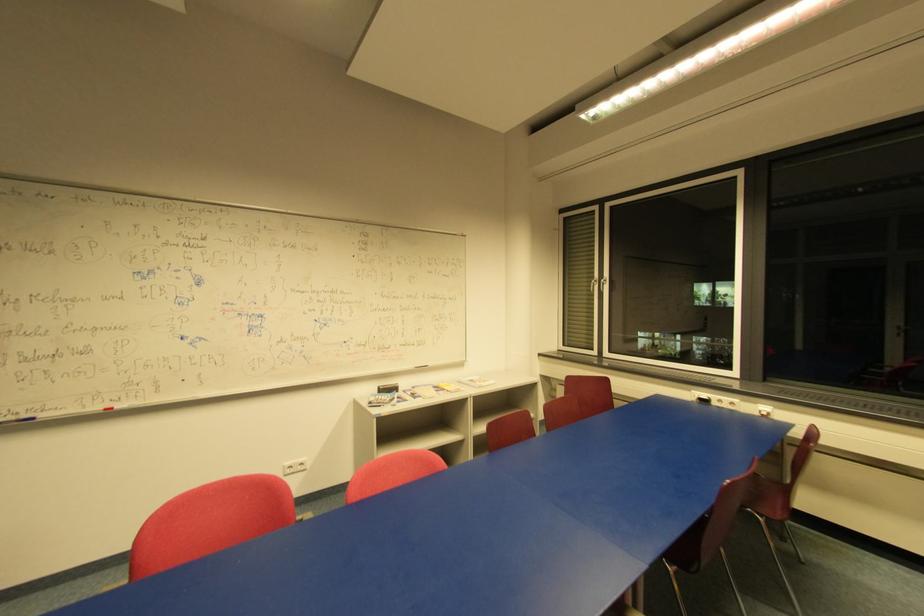
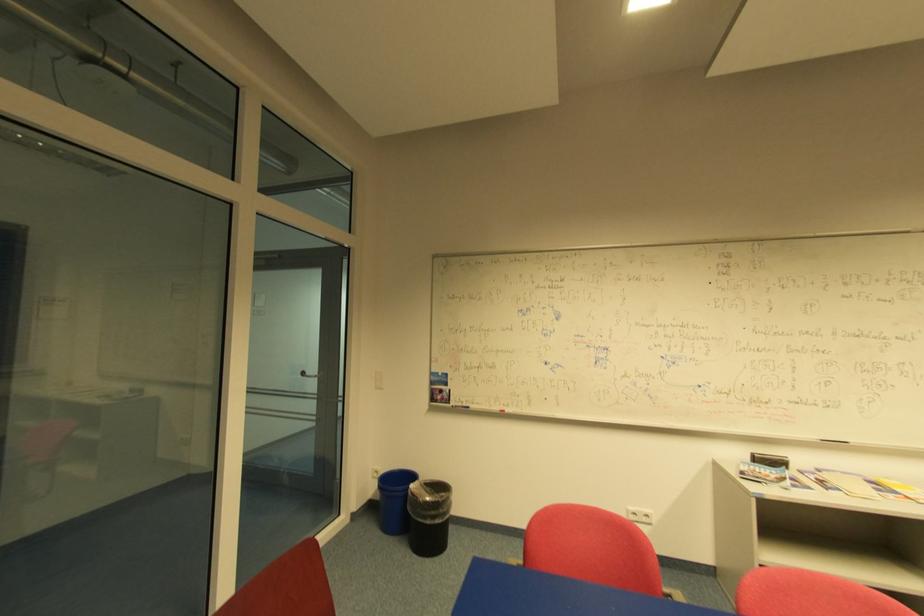
Question: The camera is either moving clockwise (left) or counter-clockwise (right) around the object. The first image is from the beginning of the video and the second image is from the end. Is the camera moving left or right when shooting the video?

Choices:
 (A) Left
 (B) Right

Answer: (B)